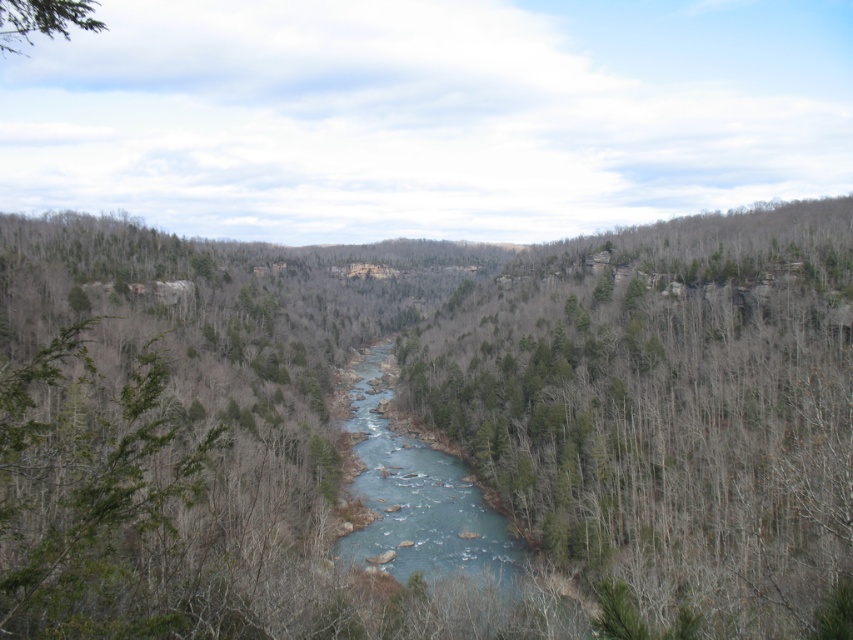
You are standing at the edge of the river and want to walk towards the green leafy tree at upper left. Which direction should you look to see the green leafy forest at center first?

The green leafy forest at center is located below the green leafy tree at upper left. So, if you look downward from the green leafy tree at upper left, you will see the green leafy forest at center first.

You are an environmental scientist studying the river ecosystem. You observe the blue smooth water at center and the green leafy tree at upper left in the image. Which object is located lower in the scene?

The blue smooth water at center is positioned under the green leafy tree at upper left, so it is lower in the scene.

You are standing at the point marked as point (434, 420) in the image. What do you see around you?

You are surrounded by a green leafy forest at center.